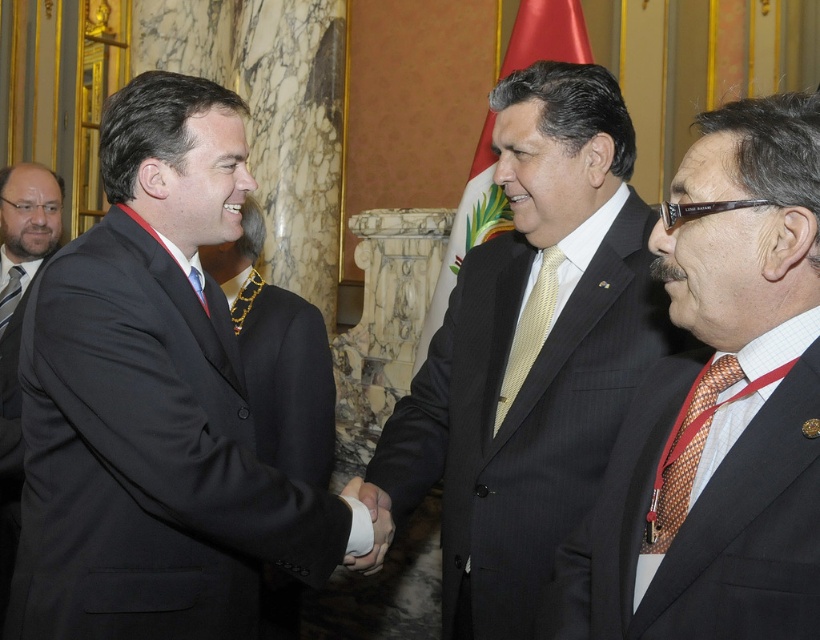
Is black matte suit at left bigger than smooth leather hand at center?

Indeed, black matte suit at left has a larger size compared to smooth leather hand at center.

Is point (43, 419) more distant than point (386, 493)?

That is False.

This screenshot has width=820, height=640. I want to click on black matte suit at left, so click(148, 458).

Can you confirm if black matte suit at left is shorter than yellow textured tie at center?

No, black matte suit at left is not shorter than yellow textured tie at center.

Is black matte suit at left taller than yellow textured tie at center?

Yes.

Is point (181, 621) positioned before point (545, 332)?

Yes, it is in front of point (545, 332).

Identify the location of black matte suit at left. The height and width of the screenshot is (640, 820). (148, 458).

Is black matte suit at left closer to the viewer compared to brown textured tie at right?

No, black matte suit at left is further to the viewer.

Between black matte suit at left and brown textured tie at right, which one appears on the right side from the viewer's perspective?

From the viewer's perspective, brown textured tie at right appears more on the right side.

This screenshot has height=640, width=820. Identify the location of black matte suit at left. (148, 458).